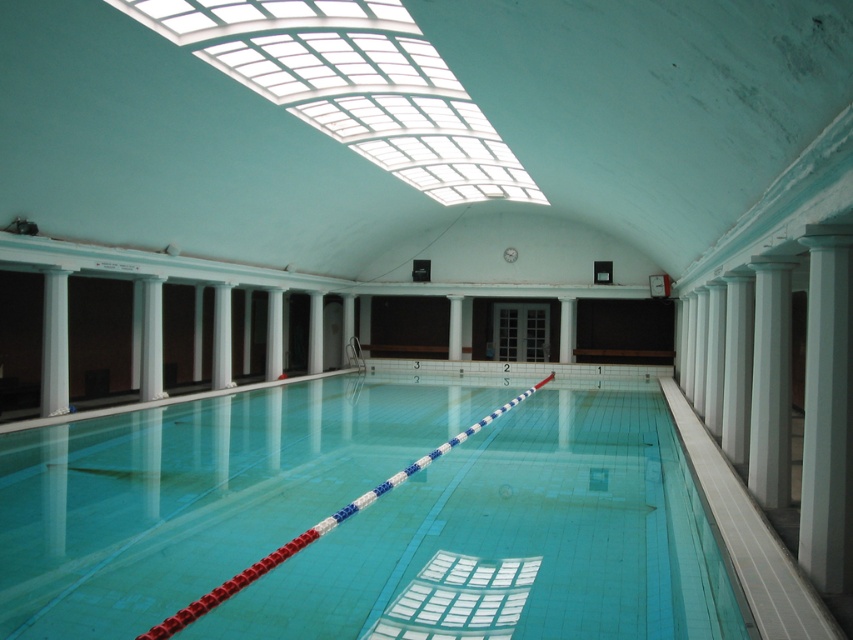
Question: Which point is closer to the camera?

Choices:
 (A) (813, 308)
 (B) (332, 458)

Answer: (A)

Question: Can you confirm if blue glossy pool at center is positioned to the right of white smooth column at right?

Choices:
 (A) yes
 (B) no

Answer: (B)

Question: Can you confirm if blue glossy pool at center is thinner than white smooth column at right?

Choices:
 (A) no
 (B) yes

Answer: (A)

Question: Is blue glossy pool at center thinner than white smooth column at right?

Choices:
 (A) no
 (B) yes

Answer: (A)

Question: Which point appears farthest from the camera in this image?

Choices:
 (A) (810, 392)
 (B) (583, 476)

Answer: (B)